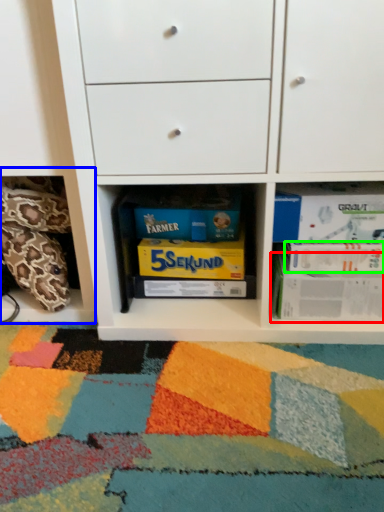
Question: Which object is positioned farthest from paperback book (highlighted by a red box)? Select from shelf (highlighted by a blue box) and paperback book (highlighted by a green box).

Choices:
 (A) shelf
 (B) paperback book

Answer: (A)